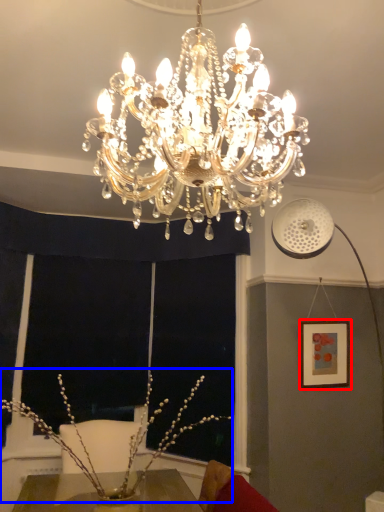
Question: Among these objects, which one is nearest to the camera, picture frame (highlighted by a red box) or floral arrangement (highlighted by a blue box)?

Choices:
 (A) picture frame
 (B) floral arrangement

Answer: (B)